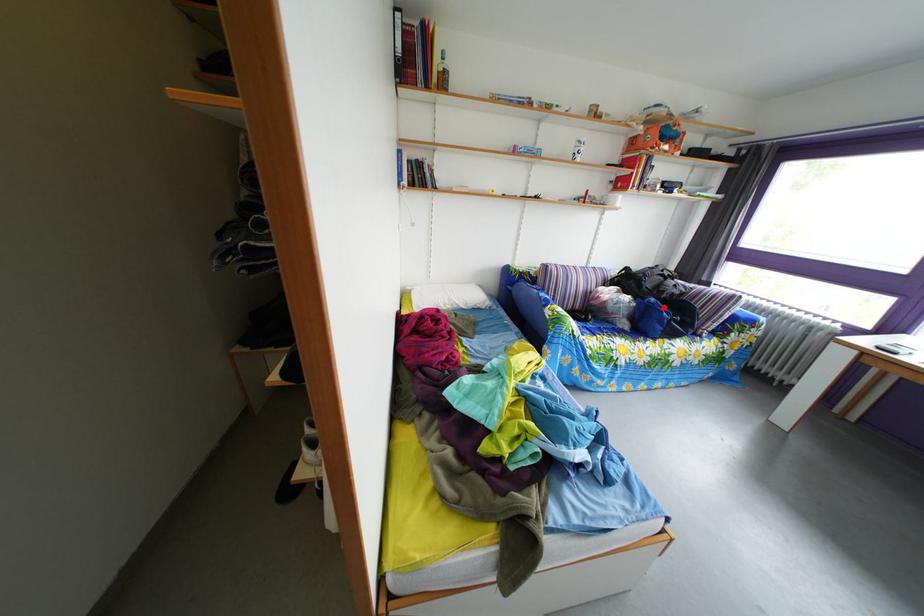
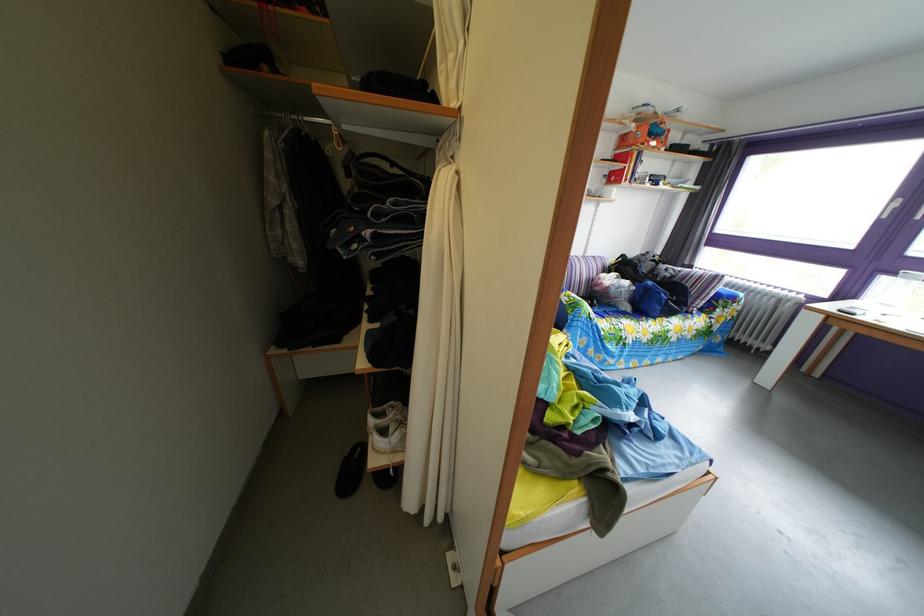
Where in the second image is the point corresponding to the highlighted location from the first image?

(661, 291)